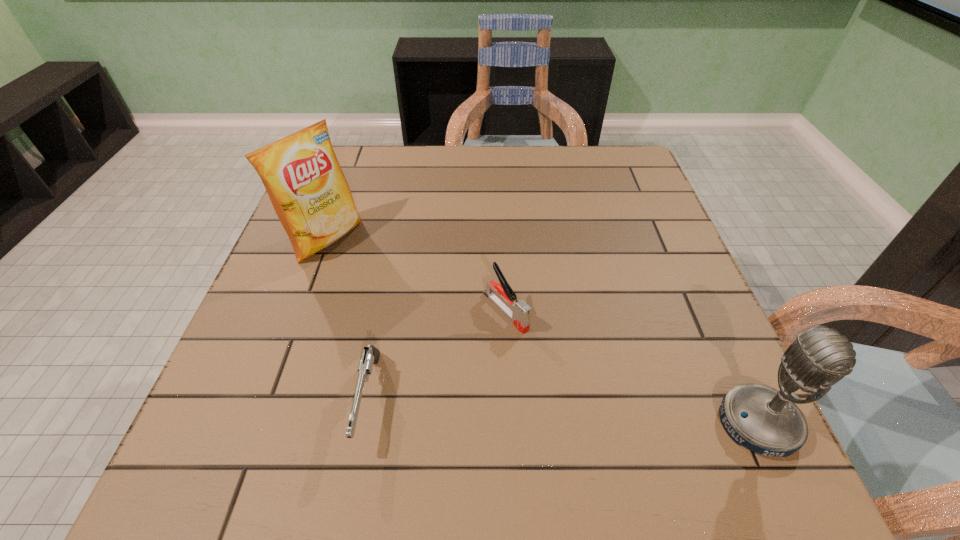
Where is `vacant space at the left edge of the desktop`? The height and width of the screenshot is (540, 960). vacant space at the left edge of the desktop is located at coordinates tap(343, 241).

The width and height of the screenshot is (960, 540). Identify the location of free region at the right edge. (641, 262).

Where is `free spot at the near left corner of the desktop`? This screenshot has width=960, height=540. free spot at the near left corner of the desktop is located at coordinates (228, 423).

I want to click on free point at the far right corner, so click(631, 154).

Identify the location of vacant space that is in between the crisp (potato chip) and the rightmost object. (542, 331).

Image resolution: width=960 pixels, height=540 pixels. I want to click on blank region between the leftmost object and the shortest object, so click(348, 319).

The height and width of the screenshot is (540, 960). Find the location of `vacant area that lies between the farthest object and the microphone`. vacant area that lies between the farthest object and the microphone is located at coordinates (542, 331).

Locate an element on the screen. Image resolution: width=960 pixels, height=540 pixels. free space between the leftmost object and the second farthest object is located at coordinates (417, 275).

Find the location of `empty location between the second object from right to left and the rightmost object`. empty location between the second object from right to left and the rightmost object is located at coordinates (632, 367).

This screenshot has width=960, height=540. I want to click on empty space that is in between the stapler and the crisp (potato chip), so click(x=417, y=275).